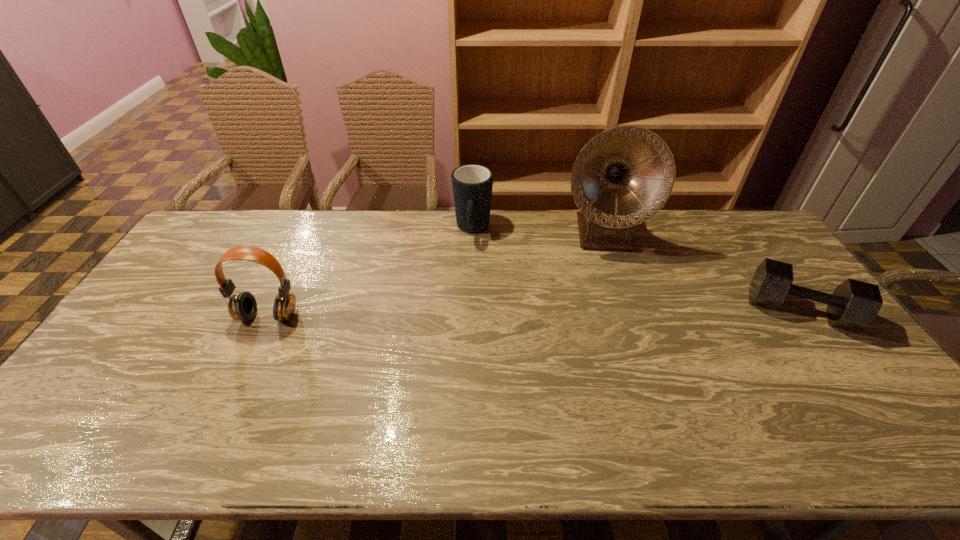
This screenshot has height=540, width=960. Identify the location of blank area located on the side of the third object from right to left with the handle. (468, 275).

The image size is (960, 540). In order to click on free space located 0.280m on the horn of the phonograph record in this screenshot , I will do `click(615, 322)`.

The image size is (960, 540). In order to click on free space located on the horn of the phonograph record in this screenshot , I will do `click(613, 307)`.

You are a GUI agent. You are given a task and a screenshot of the screen. Output one action in this format:
    pyautogui.click(x=<x>, y=<y>)
    Task: Click on the vacant space located on the horn of the phonograph record
    This screenshot has height=540, width=960.
    Given the screenshot: What is the action you would take?
    pyautogui.click(x=615, y=322)

I want to click on mug that is positioned at the far edge, so coord(472,184).

Find the location of a particular element. The height and width of the screenshot is (540, 960). phonograph record that is positioned at the far edge is located at coordinates (623, 176).

Where is `object located in the right edge section of the desktop`? The width and height of the screenshot is (960, 540). object located in the right edge section of the desktop is located at coordinates coord(853,306).

Find the location of a particular element. Image resolution: width=960 pixels, height=540 pixels. blank space at the far edge is located at coordinates (330, 236).

The image size is (960, 540). In the image, there is a desktop. What are the coordinates of `free space at the near edge` in the screenshot? It's located at (344, 401).

Find the location of `free region at the near left corner of the desktop`. free region at the near left corner of the desktop is located at coordinates (108, 410).